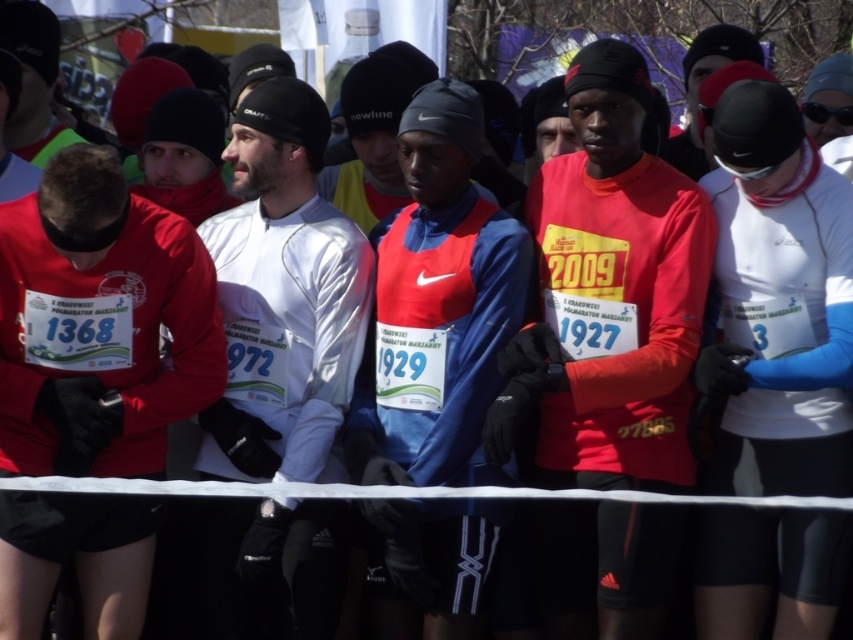
You are a photographer positioned at the center of the starting line. You want to take a photo of the white matte jacket at center. What is the 2D coordinate where you should focus your camera?

The white matte jacket at center is located at the 2D coordinate point of (283, 296), so you should focus your camera there.

You are a photographer positioned behind the starting line ribbon. You want to take a photo of the white matte running suit at center and the white matte jacket at center. Can you fit both subjects into your camera frame if your camera has a maximum horizontal field of view of 5 meters?

The white matte running suit at center and white matte jacket at center are 4.77 meters apart, so yes, both subjects can fit into the camera frame since the distance between them is less than the camera field of view of 5 meters.

You are a photographer standing behind the runners at the starting line. You want to take a photo that includes both the white matte jacket at center and the blue fabric jacket at center. The minimum distance between the two jackets in the photo must be at least 36 inches to ensure they are clearly separated. Based on their current positions, will this requirement be met?

The white matte jacket at center is 35.16 inches away from the blue fabric jacket at center. Since 35.16 inches is less than the required 36 inches, the minimum distance requirement of 36 inches will not be met.